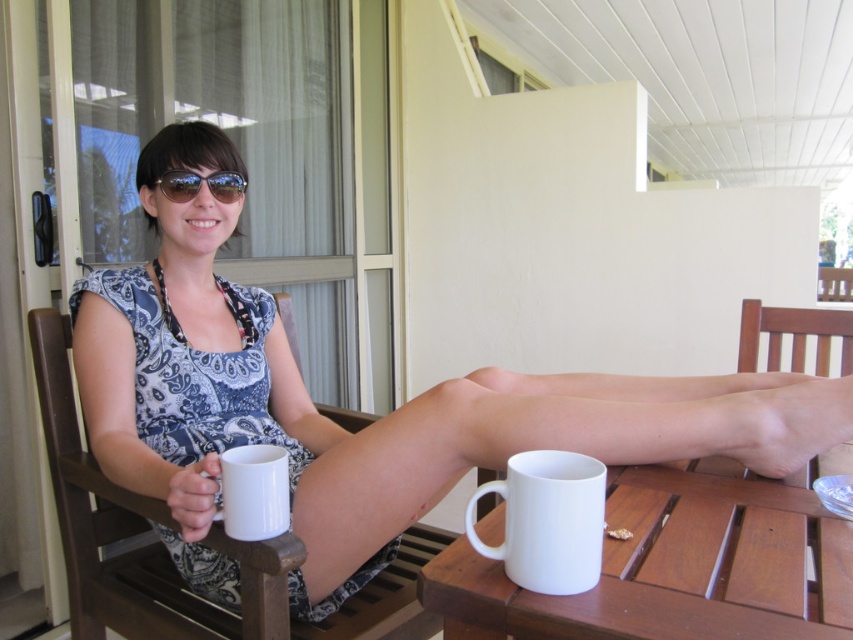
Question: Estimate the real-world distances between objects in this image. Which object is closer to the white ceramic mug at lower left?

Choices:
 (A) white ceramic mug at lower center
 (B) wooden chair at lower right

Answer: (A)

Question: Is wooden chair at left positioned before white ceramic mug at lower center?

Choices:
 (A) no
 (B) yes

Answer: (A)

Question: Which point appears farthest from the camera in this image?

Choices:
 (A) (287, 483)
 (B) (424, 636)
 (C) (717, 529)
 (D) (572, 476)

Answer: (B)

Question: Is matte fabric dress at center smaller than white ceramic mug at lower center?

Choices:
 (A) no
 (B) yes

Answer: (A)

Question: Which point is closer to the camera?

Choices:
 (A) white ceramic mug at lower center
 (B) sunglasses at center
 (C) white ceramic mug at lower left
 (D) wooden chair at left

Answer: (A)

Question: Is wooden chair at lower right bigger than white ceramic mug at lower center?

Choices:
 (A) no
 (B) yes

Answer: (B)